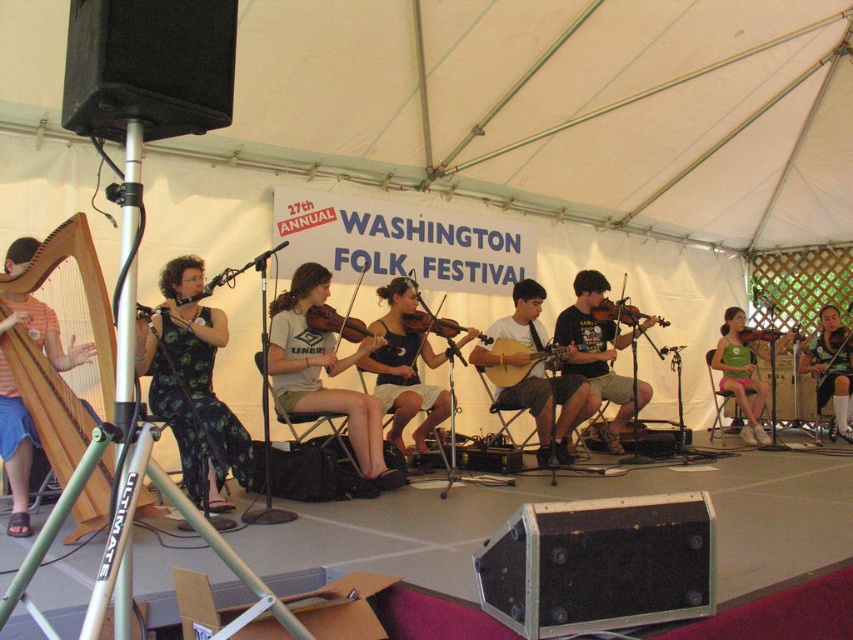
Question: Can you confirm if matte brown acoustic guitar at center is wider than wooden harp at left?

Choices:
 (A) yes
 (B) no

Answer: (A)

Question: Which of these objects is positioned closest to the green fabric shirt at center?

Choices:
 (A) green floral dress at center
 (B) matte brown acoustic guitar at center

Answer: (B)

Question: Can you confirm if light gray cotton shirt at center is thinner than matte brown acoustic guitar at center?

Choices:
 (A) no
 (B) yes

Answer: (B)

Question: Which point is closer to the camera?

Choices:
 (A) (6, 330)
 (B) (431, 401)
 (C) (851, 432)

Answer: (A)

Question: Is green fabric shirt at center thinner than light brown wooden guitar at center?

Choices:
 (A) yes
 (B) no

Answer: (A)

Question: Among these points, which one is nearest to the camera?

Choices:
 (A) (526, 348)
 (B) (390, 380)
 (C) (595, 408)
 (D) (560, 432)

Answer: (B)